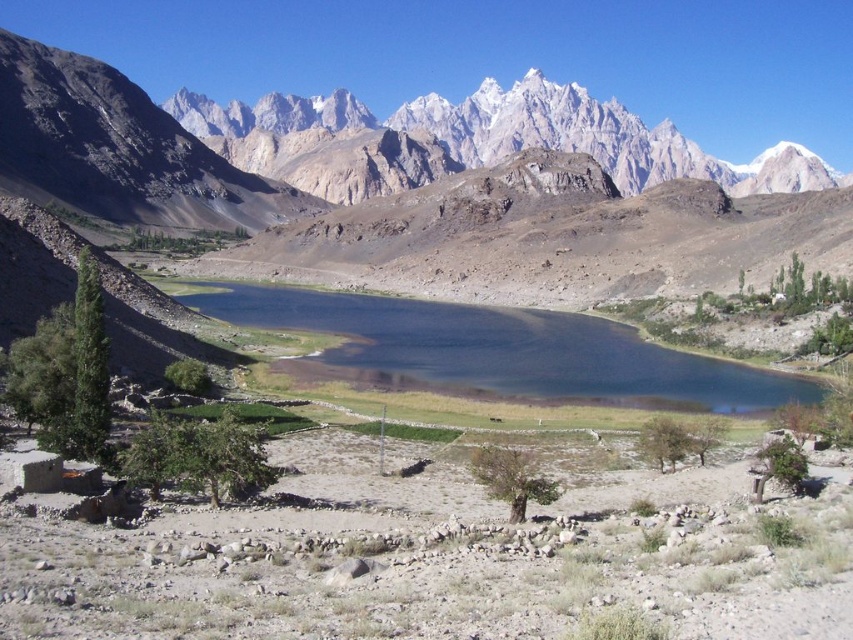
Question: Does white rocky mountain range at upper center have a greater width compared to shiny blue water at center?

Choices:
 (A) no
 (B) yes

Answer: (B)

Question: Is white rocky mountain range at upper center above shiny blue water at center?

Choices:
 (A) no
 (B) yes

Answer: (B)

Question: Can you confirm if white rocky mountain range at upper center is wider than shiny blue water at center?

Choices:
 (A) yes
 (B) no

Answer: (A)

Question: Which point is closer to the camera?

Choices:
 (A) (741, 378)
 (B) (82, 202)

Answer: (A)